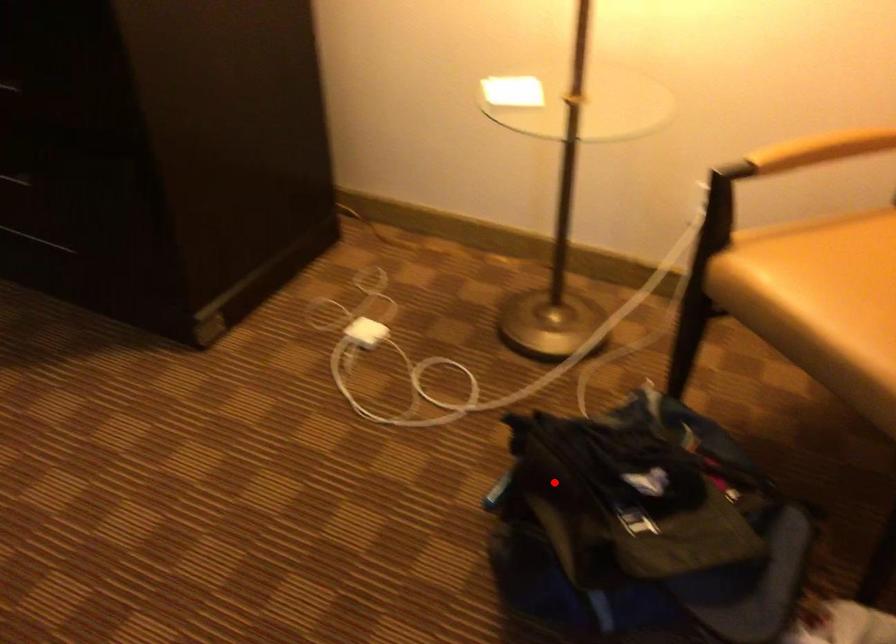
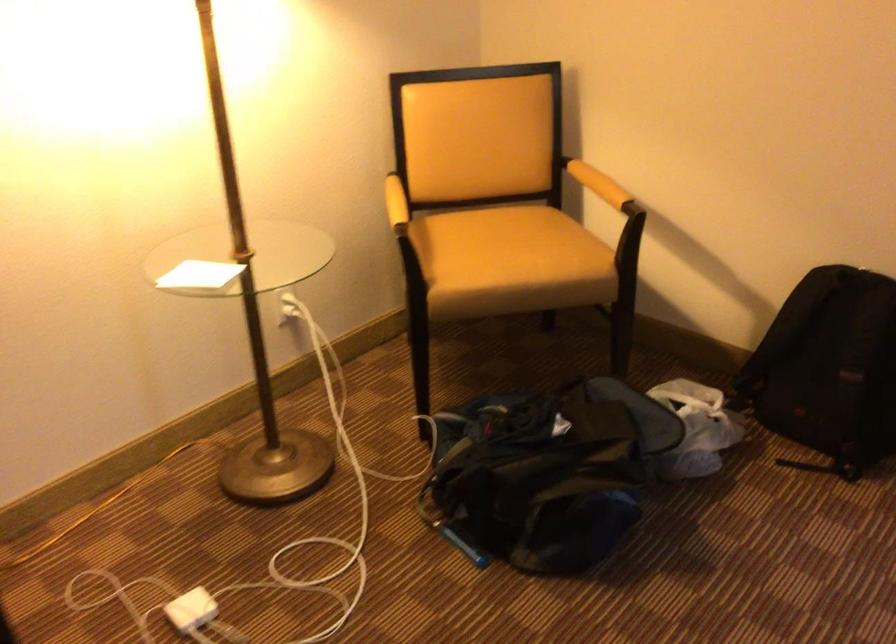
Question: I am providing you with two images of the same scene from different viewpoints. In image1, a red point is highlighted. Considering the same 3D point in image2, which of the following is correct?

Choices:
 (A) It is closer
 (B) It is farther

Answer: (B)